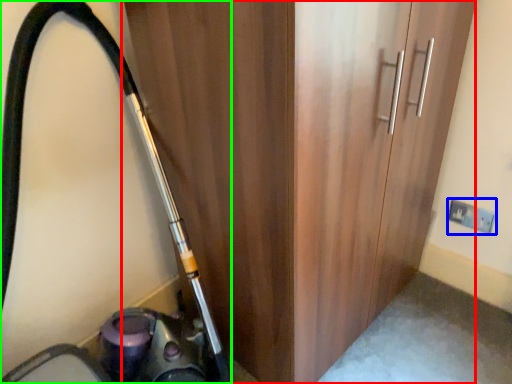
Question: Considering the real-world distances, which object is closest to door (highlighted by a red box)? electric outlet (highlighted by a blue box) or equipment (highlighted by a green box).

Choices:
 (A) electric outlet
 (B) equipment

Answer: (B)